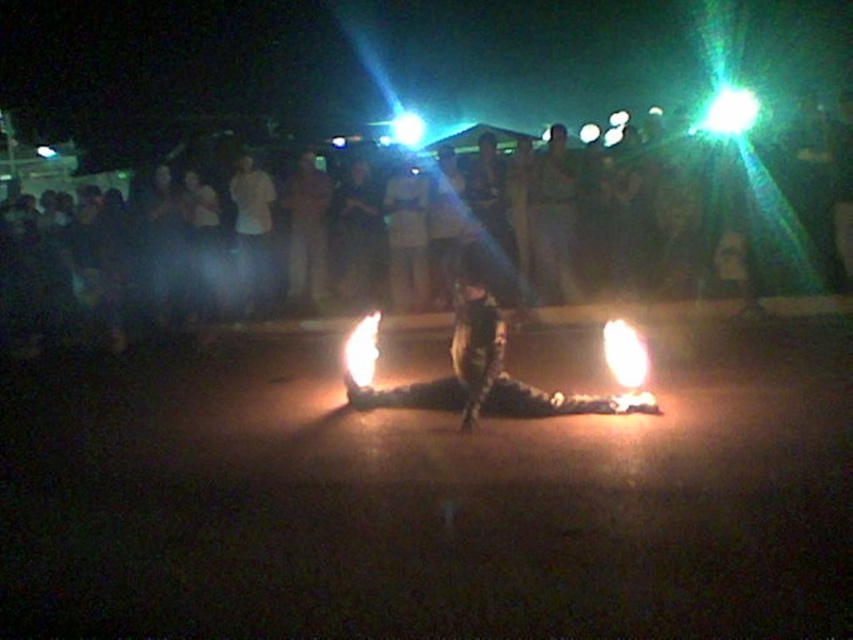
Question: Can you confirm if camouflage-patterned pants at center is thinner than bright orange flame at center?

Choices:
 (A) yes
 (B) no

Answer: (B)

Question: Which of these objects is positioned farthest from the bright orange flame at center?

Choices:
 (A) camouflage-patterned pants at center
 (B) dark clothing crowd at upper center

Answer: (B)

Question: Which object is positioned closest to the bright orange flame at center?

Choices:
 (A) dark clothing crowd at upper center
 (B) camouflage-patterned pants at center

Answer: (B)

Question: Can you confirm if camouflage-patterned pants at center is positioned to the left of bright orange flame at center?

Choices:
 (A) yes
 (B) no

Answer: (B)

Question: Is camouflage-patterned pants at center to the right of bright orange flame at center from the viewer's perspective?

Choices:
 (A) no
 (B) yes

Answer: (B)

Question: Based on their relative distances, which object is nearer to the camouflage-patterned pants at center?

Choices:
 (A) dark clothing crowd at upper center
 (B) bright orange flame at center

Answer: (B)